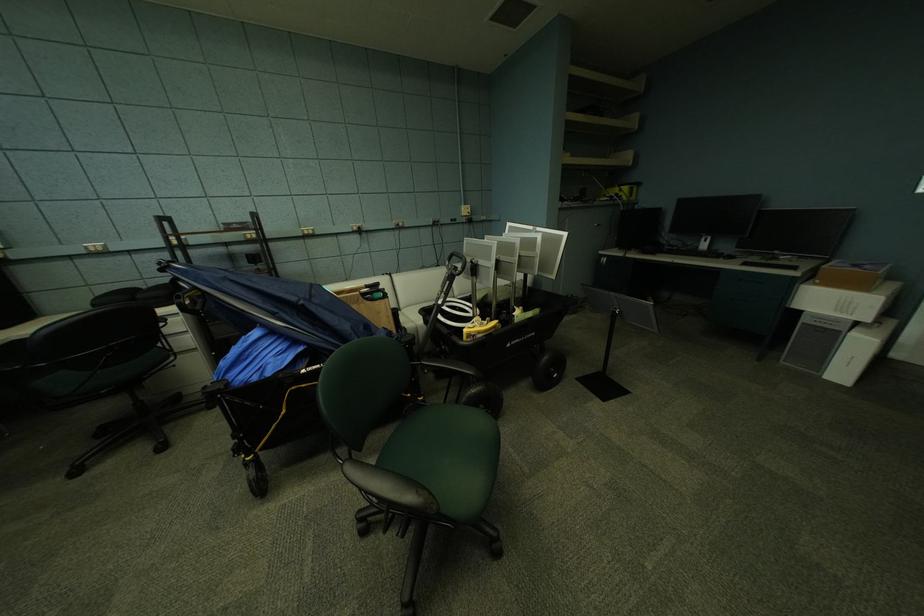
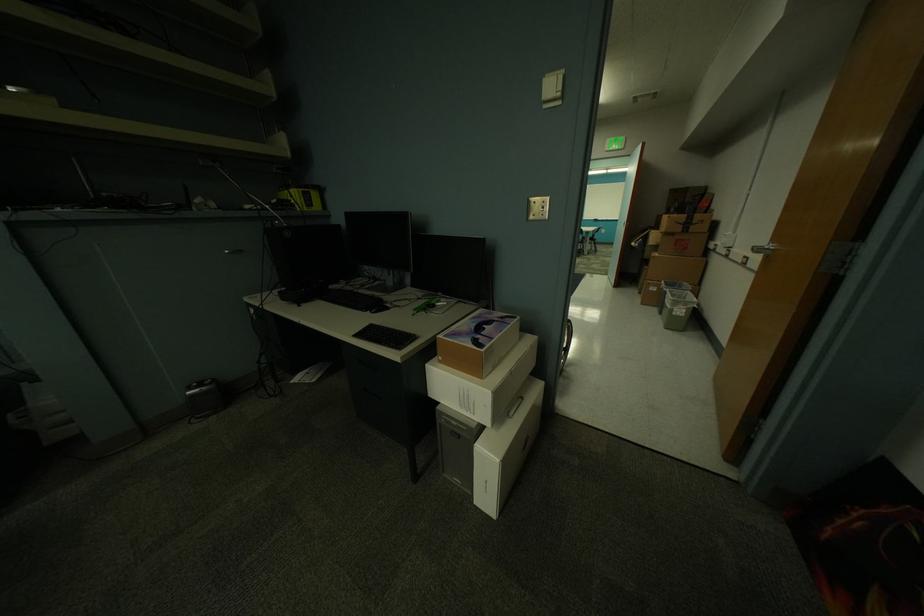
What movement of the cameraman would produce the second image?

The cameraman moved toward right, forward.